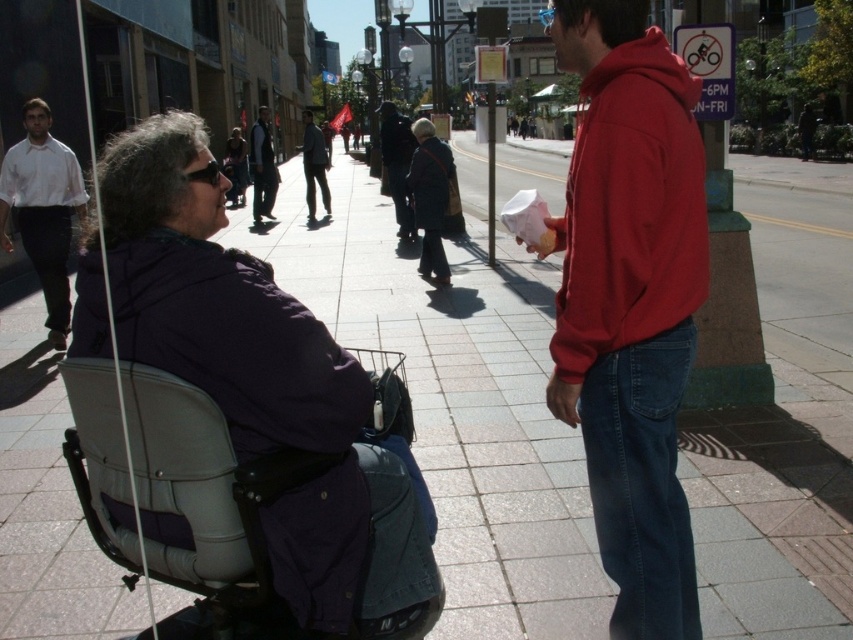
You are a delivery person trying to navigate through the sidewalk. You see a dark gray suit at center and a matte purple jacket at center. Which one is wider?

The dark gray suit at center is wider than the matte purple jacket at center.

Consider the image. You are a delivery person trying to navigate through the sidewalk. You see the purple soft fabric wheelchair at left and the white shirt at left. Which object is closer to the ground?

The purple soft fabric wheelchair at left is positioned under the white shirt at left, meaning it is closer to the ground.

You are a delivery person needing to navigate through the sidewalk. You see the purple soft fabric wheelchair at left and the white shirt at left. Which object takes up more space on the sidewalk?

The white shirt at left takes up more space than the purple soft fabric wheelchair at left.